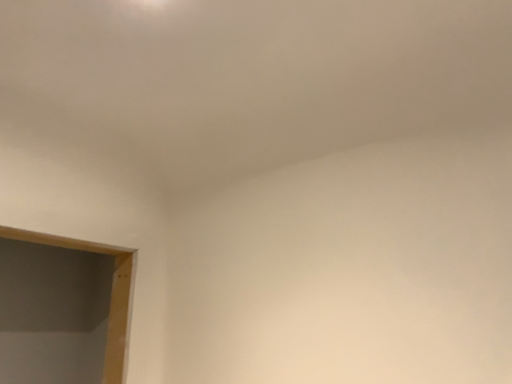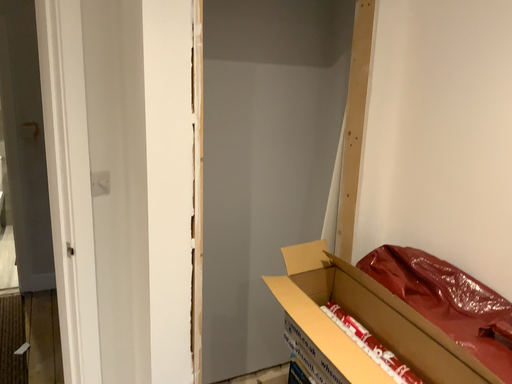
Question: How did the camera likely rotate when shooting the video?

Choices:
 (A) rotated left
 (B) rotated right

Answer: (A)